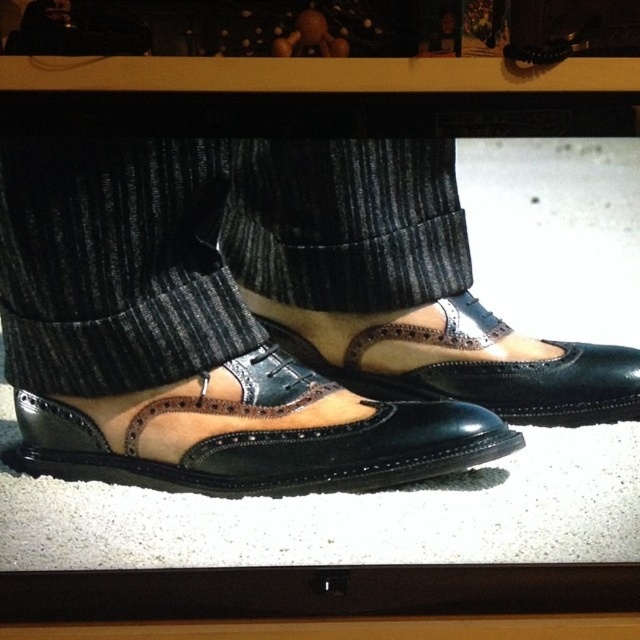
Looking at this image, you are standing 3.61 feet away from the suede leather shoes at center. If you want to pick them up, will you need to move closer?

Yes, you need to move closer because the suede leather shoes at center are 3.61 feet away from you, which is farther than the typical comfortable reaching distance for picking up an object.